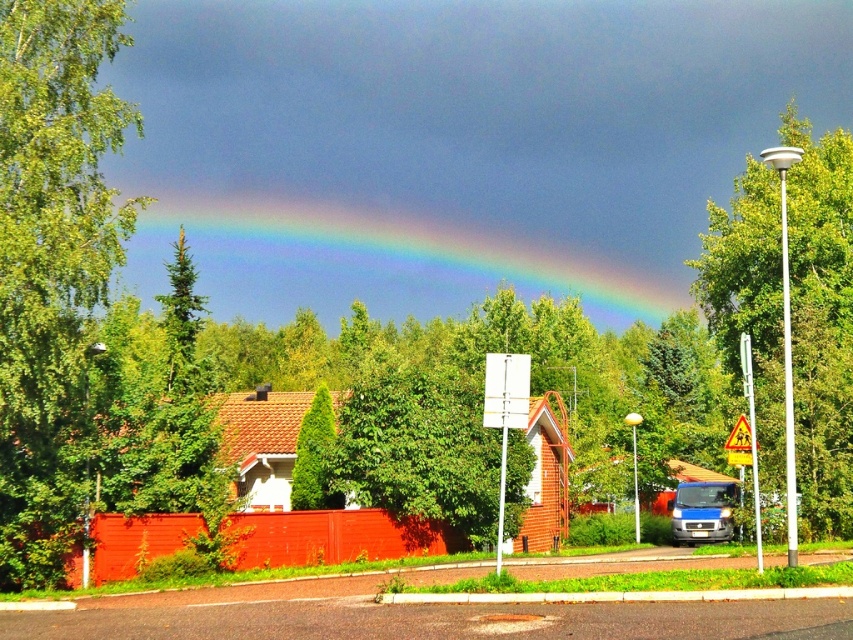
Question: Estimate the real-world distances between objects in this image. Which object is farther from the green textured tree at center?

Choices:
 (A) green leafy tree at right
 (B) yellow reflective triangle at right

Answer: (A)

Question: Which point is closer to the camera taking this photo?

Choices:
 (A) (82, 216)
 (B) (392, 214)

Answer: (A)

Question: Can you confirm if rainbow at upper center is positioned below yellow reflective triangle at right?

Choices:
 (A) no
 (B) yes

Answer: (A)

Question: Among these points, which one is farthest from the camera?

Choices:
 (A) (735, 499)
 (B) (756, 448)
 (C) (433, 508)
 (D) (334, 260)

Answer: (D)

Question: Can you confirm if rainbow at upper center is positioned to the right of green leafy tree at center?

Choices:
 (A) no
 (B) yes

Answer: (A)

Question: Does green textured tree at center have a greater width compared to blue metallic van at lower right?

Choices:
 (A) yes
 (B) no

Answer: (B)